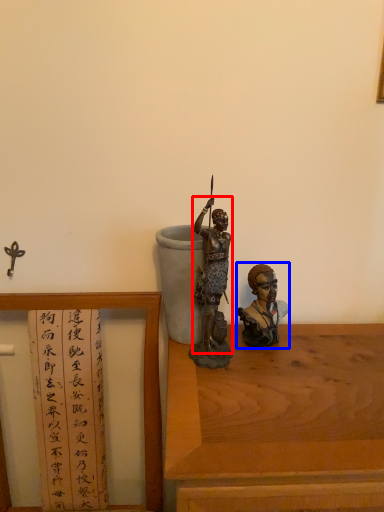
Question: Which point is further to the camera, person (highlighted by a red box) or person (highlighted by a blue box)?

Choices:
 (A) person
 (B) person

Answer: (B)